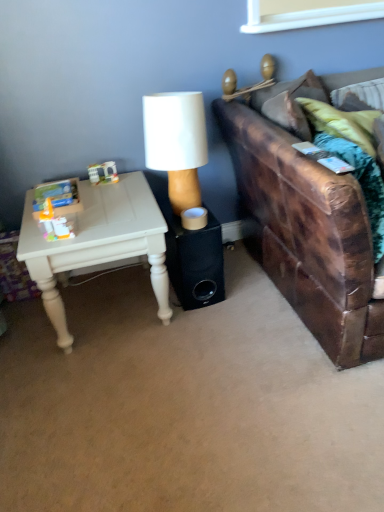
At what (x,y) coordinates should I click in order to perform the action: click on vacant area that lies in front of black matte speaker at center. Please return your answer as a coordinate pair (x, y). Looking at the image, I should click on (198, 326).